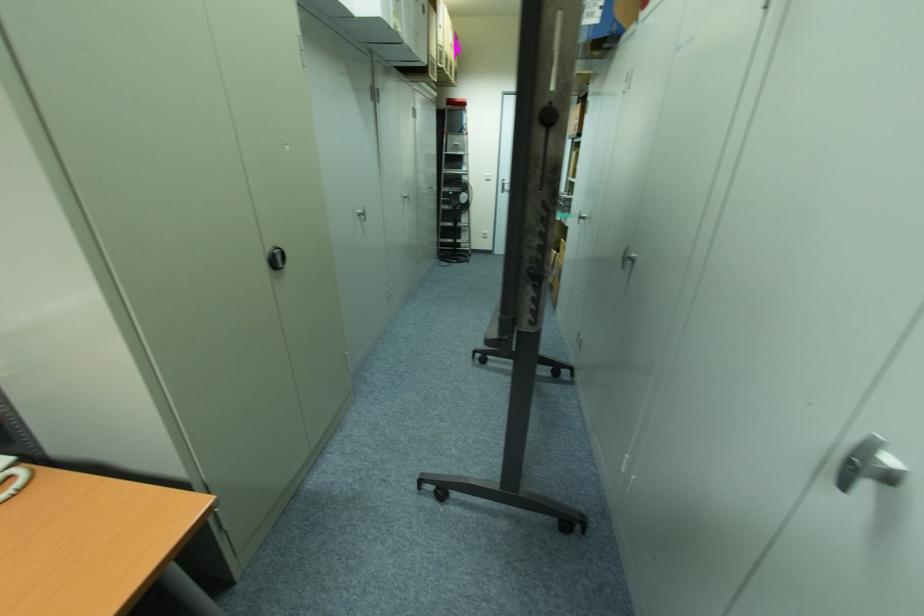
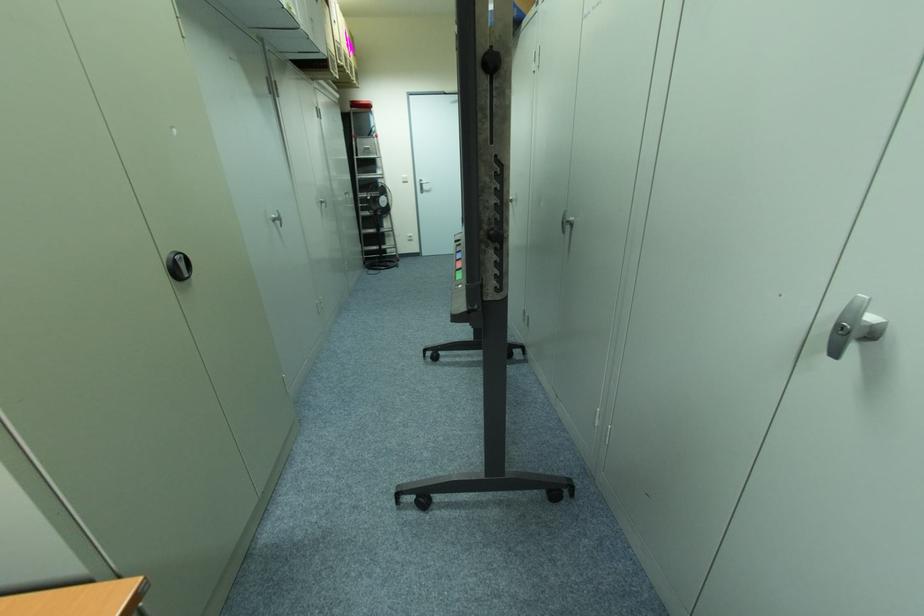
The point at (361, 215) is marked in the first image. Where is the corresponding point in the second image?

(274, 220)